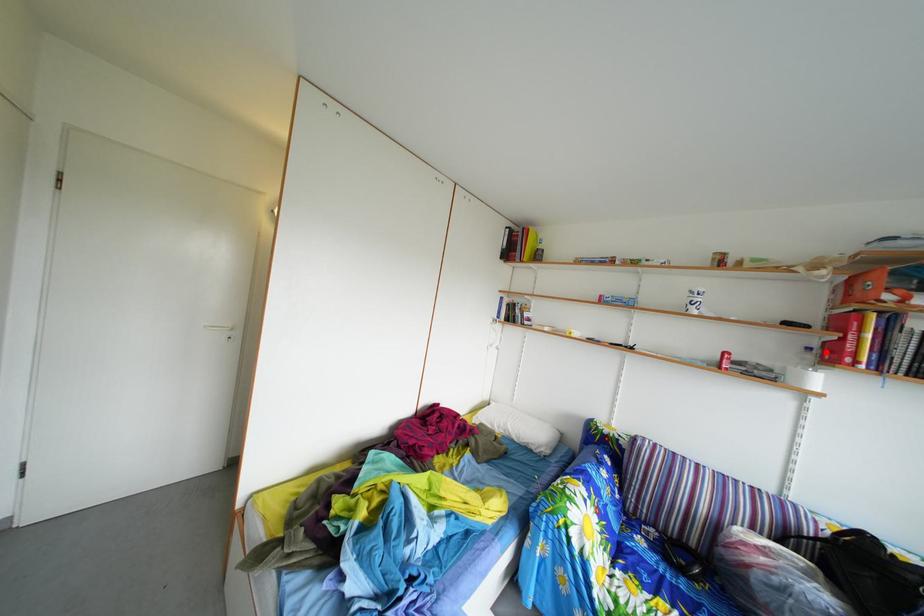
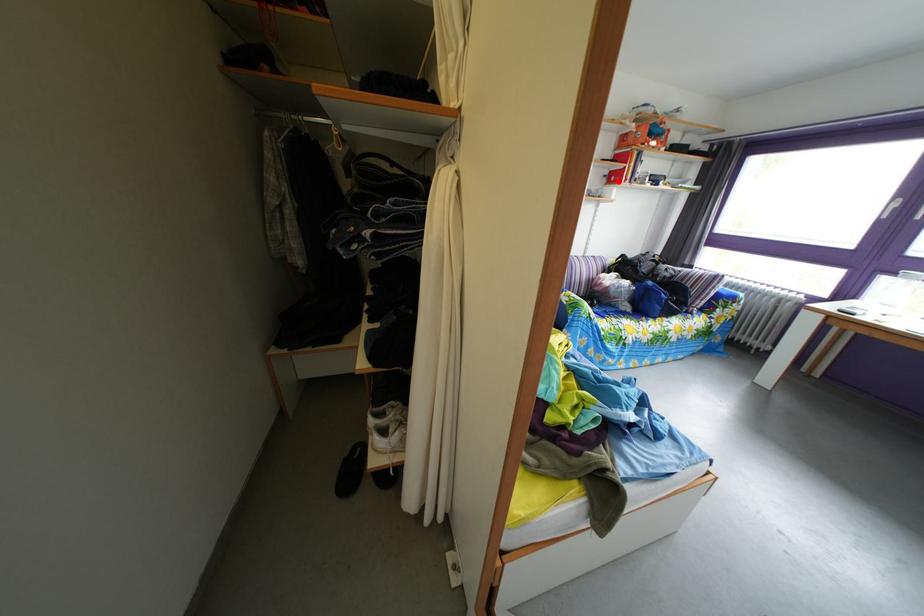
I am providing you with two images of the same scene from different viewpoints. A red point is marked on the first image and another point is marked on the second image. Is the red point in image1 aligned with the point shown in image2?

Yes